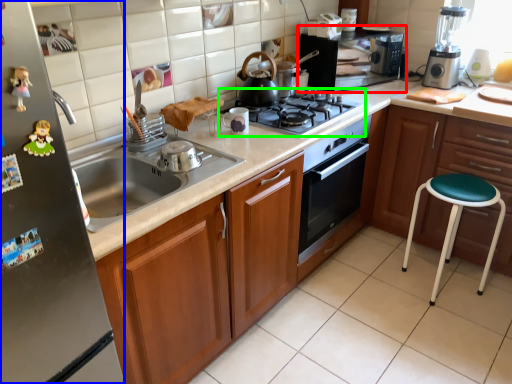
Question: Based on their relative distances, which object is nearer to home appliance (highlighted by a red box)? Choose from fridge (highlighted by a blue box) and gas stove (highlighted by a green box).

Choices:
 (A) fridge
 (B) gas stove

Answer: (B)